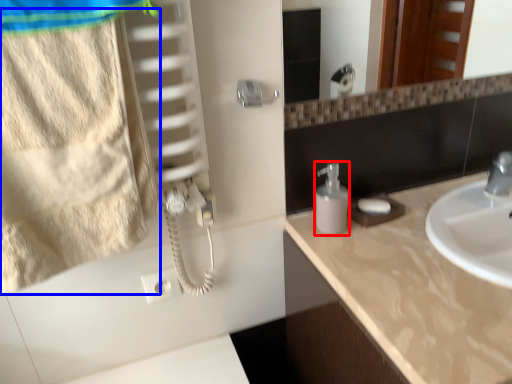
Question: Which point is closer to the camera, soap dispenser (highlighted by a red box) or beach towel (highlighted by a blue box)?

Choices:
 (A) soap dispenser
 (B) beach towel

Answer: (B)